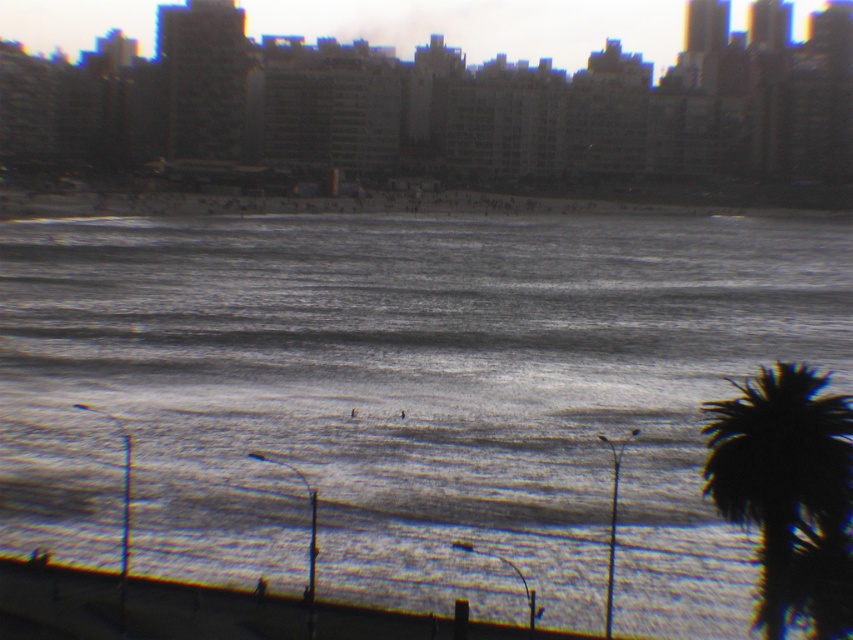
Is dark green leafy palm tree at lower right behind smooth concrete wall at lower center?

That is False.

Does dark green leafy palm tree at lower right have a greater height compared to smooth concrete wall at lower center?

Yes, dark green leafy palm tree at lower right is taller than smooth concrete wall at lower center.

The image size is (853, 640). In order to click on dark green leafy palm tree at lower right in this screenshot , I will do `click(788, 492)`.

How far apart are gray water at center and dark green leafy palm tree at lower right?

93.36 feet

Does gray water at center have a lesser width compared to dark green leafy palm tree at lower right?

In fact, gray water at center might be wider than dark green leafy palm tree at lower right.

This screenshot has height=640, width=853. I want to click on gray water at center, so click(405, 397).

In order to click on gray water at center in this screenshot , I will do `click(405, 397)`.

You are a GUI agent. You are given a task and a screenshot of the screen. Output one action in this format:
    pyautogui.click(x=<x>, y=<y>)
    Task: Click on the gray water at center
    
    Given the screenshot: What is the action you would take?
    pyautogui.click(x=405, y=397)

I want to click on gray water at center, so tap(405, 397).